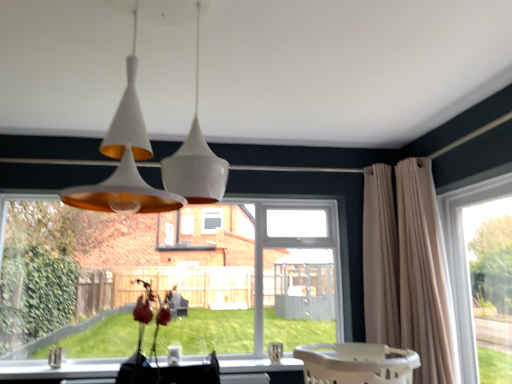
Question: Is point (79, 266) positioned closer to the camera than point (425, 195)?

Choices:
 (A) closer
 (B) farther

Answer: (B)

Question: Is clear glass window at lower left, marked as the second window in a right-to-left arrangement, bigger or smaller than beige fabric curtain at right, which ranks as the 2th curtain in left-to-right order?

Choices:
 (A) small
 (B) big

Answer: (B)

Question: Estimate the real-world distances between objects in this image. Which object is farther from the beige fabric curtain at right, which ranks as the 2th curtain in left-to-right order?

Choices:
 (A) beige plastic baby carriage at lower center
 (B) beige fabric curtain at right, which is the 2th curtain from right to left
 (C) clear glass window at lower left, marked as the second window in a right-to-left arrangement
 (D) white glossy pendant light at upper center
 (E) transparent glass window at right, the first window when ordered from right to left

Answer: (C)

Question: Which object is the closest to the white glossy pendant light at upper center?

Choices:
 (A) transparent glass window at right, the first window when ordered from right to left
 (B) beige fabric curtain at right, which ranks as the 2th curtain in left-to-right order
 (C) beige fabric curtain at right, which is the 2th curtain from right to left
 (D) clear glass window at lower left, positioned as the first window in left-to-right order
 (E) beige plastic baby carriage at lower center

Answer: (E)